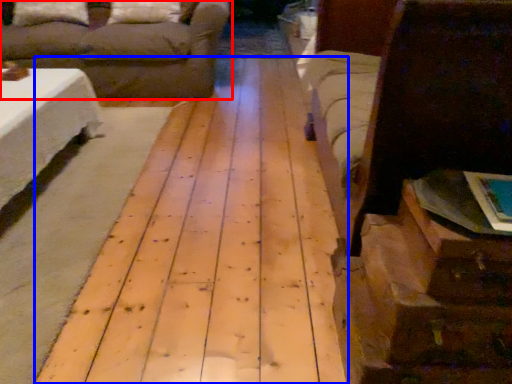
Question: Which object is closer to the camera taking this photo, studio couch (highlighted by a red box) or plywood (highlighted by a blue box)?

Choices:
 (A) studio couch
 (B) plywood

Answer: (B)